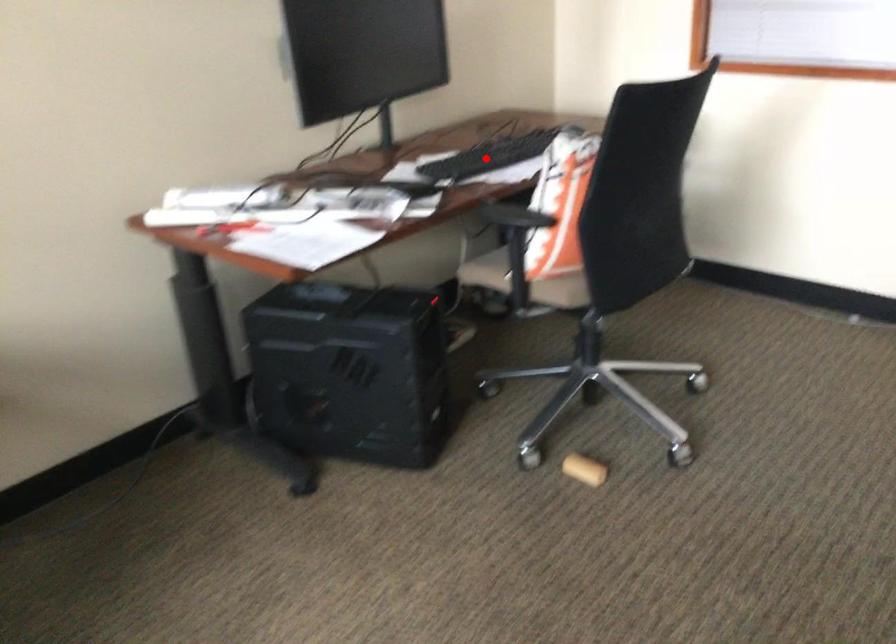
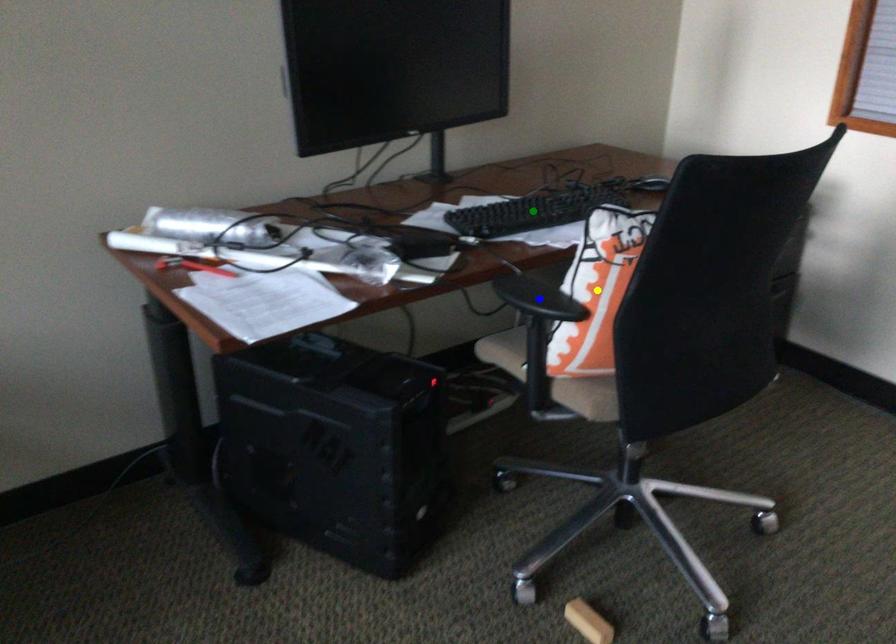
Question: I am providing you with two images of the same scene from different viewpoints. A red point is marked on the first image. You are given multiple points on the second image. Can you choose the point in image 2 that corresponds to the point in image 1?

Choices:
 (A) yellow point
 (B) blue point
 (C) green point

Answer: (C)